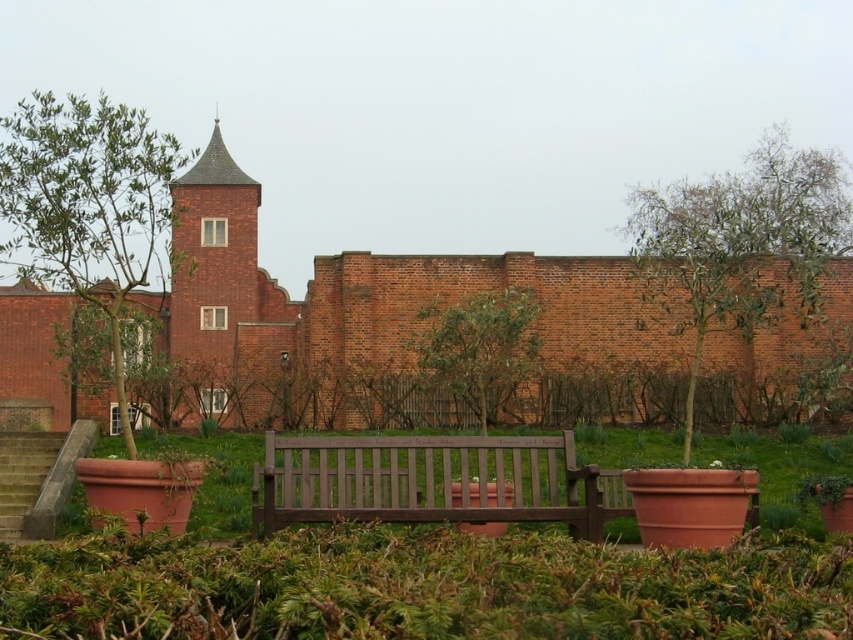
Question: Which point is farther to the camera?

Choices:
 (A) concrete stairs at lower left
 (B) dark brown wooden bench at center

Answer: (A)

Question: Does dark brown wooden bench at center lie in front of concrete stairs at lower left?

Choices:
 (A) yes
 (B) no

Answer: (A)

Question: Does dark brown wooden bench at center have a smaller size compared to concrete stairs at lower left?

Choices:
 (A) yes
 (B) no

Answer: (B)

Question: From the image, what is the correct spatial relationship of dark brown wooden bench at center in relation to concrete stairs at lower left?

Choices:
 (A) right
 (B) left

Answer: (A)

Question: Which object is farther from the camera taking this photo?

Choices:
 (A) dark brown wooden bench at center
 (B) concrete stairs at lower left

Answer: (B)